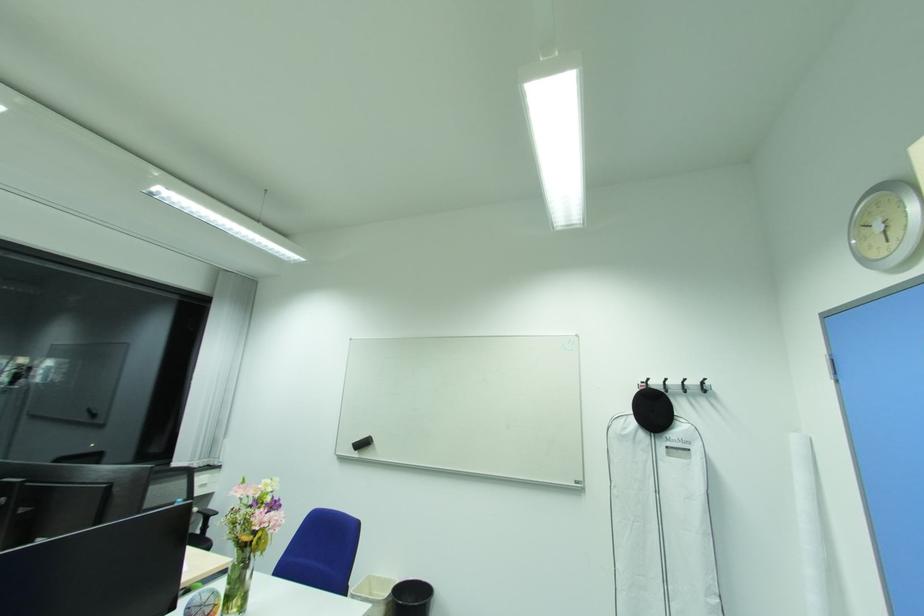
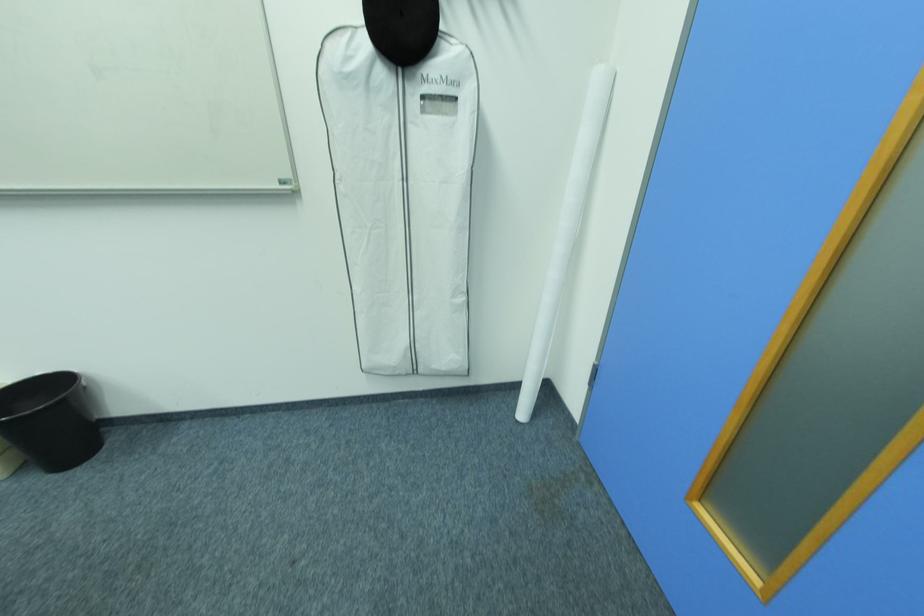
Find the pixel in the second image that matches (x=673, y=448) in the first image.

(428, 98)